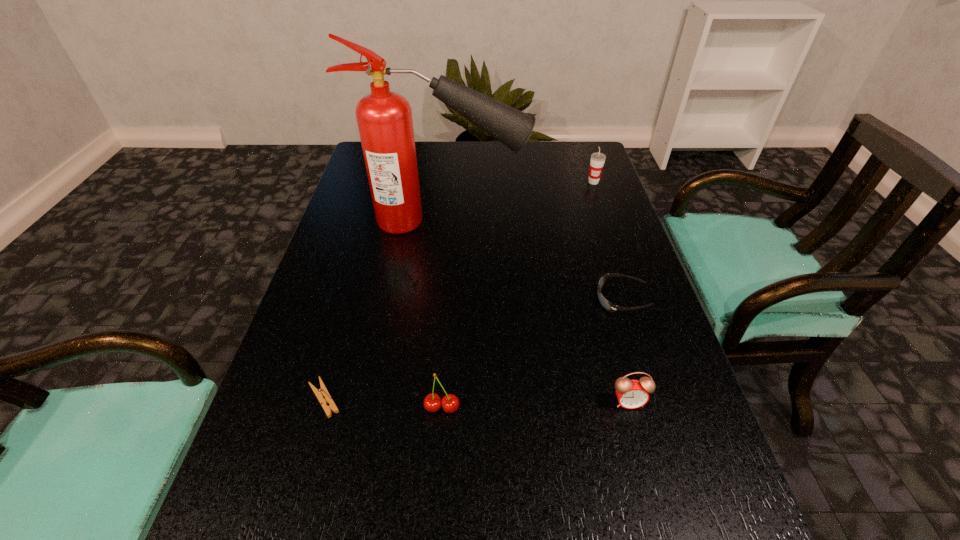
Where is `free space located on the side of the fifth shortest object with the logo`? This screenshot has height=540, width=960. free space located on the side of the fifth shortest object with the logo is located at coordinates (616, 248).

Identify the location of free space located with the stems of the cherry pointing upwards. The height and width of the screenshot is (540, 960). (434, 520).

You are a GUI agent. You are given a task and a screenshot of the screen. Output one action in this format:
    pyautogui.click(x=<x>, y=<y>)
    Task: Click on the vacant point located 0.050m on the clock face of the alarm clock
    The image size is (960, 540).
    Given the screenshot: What is the action you would take?
    pyautogui.click(x=637, y=436)

The width and height of the screenshot is (960, 540). What are the coordinates of `vacant space located on the lenses of the third farthest object` in the screenshot? It's located at [533, 299].

The height and width of the screenshot is (540, 960). Find the location of `vacant space located 0.340m on the lenses of the third farthest object`. vacant space located 0.340m on the lenses of the third farthest object is located at coordinates (444, 299).

You are a GUI agent. You are given a task and a screenshot of the screen. Output one action in this format:
    pyautogui.click(x=<x>, y=<y>)
    Task: Click on the free location located 0.120m on the lenses of the third farthest object
    Image resolution: width=960 pixels, height=540 pixels.
    Given the screenshot: What is the action you would take?
    pyautogui.click(x=542, y=299)

Identify the location of vacant space situated on the back of the shortest object. (346, 323).

This screenshot has width=960, height=540. What are the coordinates of `object that is positioned at the far edge` in the screenshot? It's located at (597, 161).

Find the location of a particular element. fire extinguisher positioned at the left edge is located at coordinates (384, 118).

Where is `clothespin that is at the left edge`? clothespin that is at the left edge is located at coordinates (322, 391).